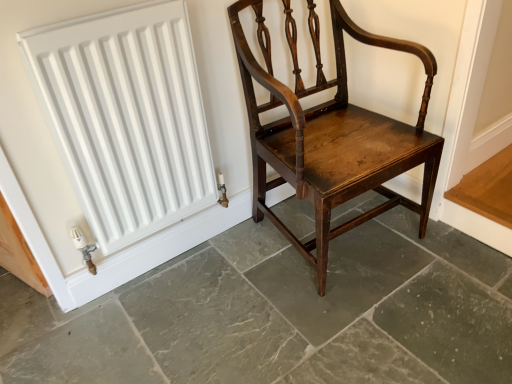
The image size is (512, 384). I want to click on free space in front of shiny dark wood chair at center, so click(x=358, y=323).